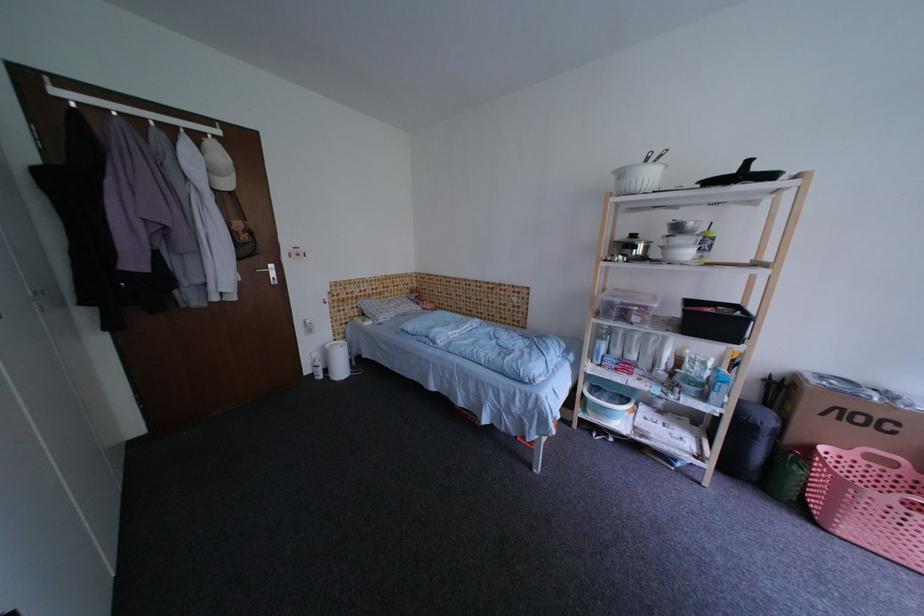
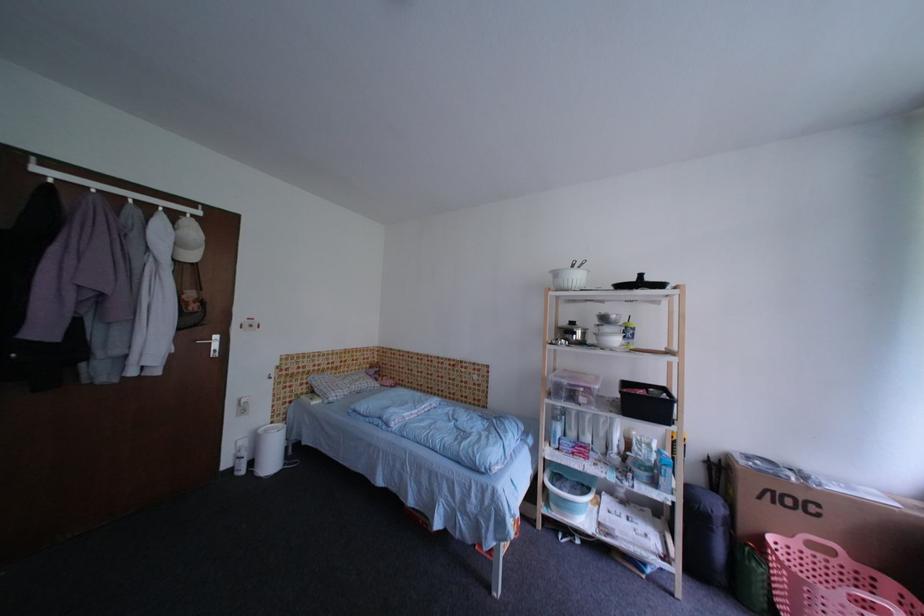
Consider the image. Which direction would the cameraman need to move to produce the second image?

The cameraman moved toward right, backward.